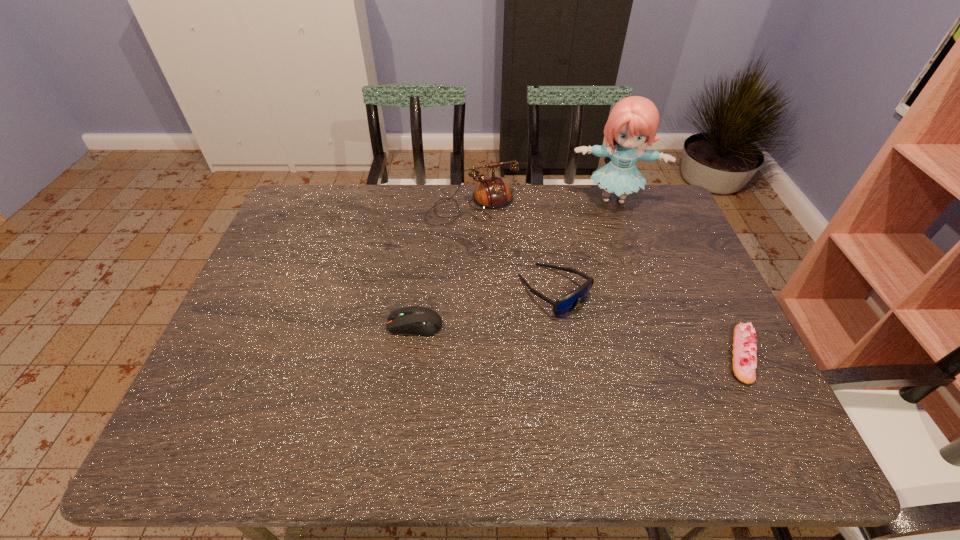
At what (x,y) coordinates should I click in order to perform the action: click on computer equipment. Please return your answer as a coordinate pair (x, y). Image resolution: width=960 pixels, height=540 pixels. Looking at the image, I should click on (418, 320).

In order to click on eclair in this screenshot , I will do `click(744, 362)`.

This screenshot has height=540, width=960. Find the location of `sunglasses`. sunglasses is located at coordinates (565, 304).

The width and height of the screenshot is (960, 540). I want to click on doll, so click(634, 120).

In order to click on the second tallest object in this screenshot , I will do `click(493, 193)`.

Image resolution: width=960 pixels, height=540 pixels. In order to click on free region located on the button of the computer equipment in this screenshot , I will do `click(340, 325)`.

At what (x,y) coordinates should I click in order to perform the action: click on free region located on the button of the computer equipment. Please return your answer as a coordinate pair (x, y). The width and height of the screenshot is (960, 540). Looking at the image, I should click on (324, 325).

Image resolution: width=960 pixels, height=540 pixels. In order to click on free space located 0.380m on the button of the computer equipment in this screenshot , I will do `click(236, 325)`.

Locate an element on the screen. Image resolution: width=960 pixels, height=540 pixels. free space located on the back of the eclair is located at coordinates (698, 262).

Where is `vacant space situated on the front-facing side of the third shortest object`? vacant space situated on the front-facing side of the third shortest object is located at coordinates (665, 378).